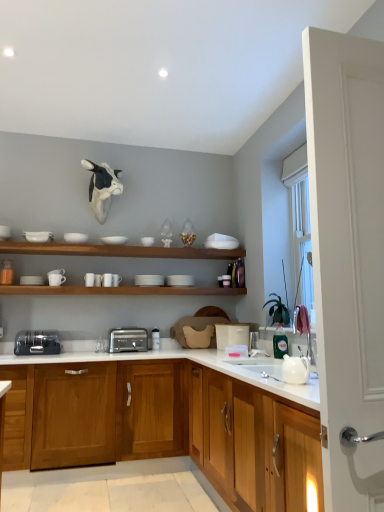
Describe the element at coordinates (149, 280) in the screenshot. The width and height of the screenshot is (384, 512). I see `white matte stack of plates at upper center, the 2th tableware from the right` at that location.

Locate an element on the screen. The height and width of the screenshot is (512, 384). white matte plate at center, which is counted as the 1th tableware, starting from the right is located at coordinates (180, 280).

This screenshot has height=512, width=384. What do you see at coordinates (114, 240) in the screenshot? I see `white matte bowl at upper center, which ranks as the fifth tableware in left-to-right order` at bounding box center [114, 240].

You are a GUI agent. You are given a task and a screenshot of the screen. Output one action in this format:
    pyautogui.click(x=<x>, y=<y>)
    Task: Click on the white matte cup at left, the first tableware when ordered from left to right
    Image resolution: width=384 pixels, height=512 pixels.
    Given the screenshot: What is the action you would take?
    pyautogui.click(x=32, y=280)

In the scene shown: Between white matte cup at center, which is the sixth tableware from right to left, and satin silver toaster at lower left, positioned as the 2th toaster in right-to-left order, which one has smaller size?

white matte cup at center, which is the sixth tableware from right to left, is smaller.

Is white matte cup at center, which is the third tableware in left-to-right order, facing away from satin silver toaster at lower left, positioned as the 2th toaster in right-to-left order?

white matte cup at center, which is the third tableware in left-to-right order, does not have its back to satin silver toaster at lower left, positioned as the 2th toaster in right-to-left order.

In the scene shown: Is there a large distance between white matte cup at center, which is the third tableware in left-to-right order, and satin silver toaster at lower left, positioned as the 2th toaster in right-to-left order?

Actually, white matte cup at center, which is the third tableware in left-to-right order, and satin silver toaster at lower left, positioned as the 2th toaster in right-to-left order, are a little close together.

From a real-world perspective, does white glossy teapot at lower right stand above satin silver toaster at lower left, the first toaster in the left-to-right sequence?

No, from a real-world perspective, white glossy teapot at lower right is not above satin silver toaster at lower left, the first toaster in the left-to-right sequence.

From the image's perspective, relative to satin silver toaster at lower left, positioned as the 2th toaster in right-to-left order, is white glossy teapot at lower right above or below?

Based on their image positions, white glossy teapot at lower right is located above satin silver toaster at lower left, positioned as the 2th toaster in right-to-left order.

Between white glossy teapot at lower right and satin silver toaster at lower left, positioned as the 2th toaster in right-to-left order, which one appears on the right side from the viewer's perspective?

white glossy teapot at lower right is more to the right.

How different are the orientations of white glossy teapot at lower right and satin silver toaster at lower left, the first toaster in the left-to-right sequence, in degrees?

white glossy teapot at lower right and satin silver toaster at lower left, the first toaster in the left-to-right sequence, are facing 93.3 degrees away from each other.

Can white matte cup at left, the 8th tableware viewed from the right, be found inside white matte bowl at upper center, which is the 4th tableware in right-to-left order?

That's incorrect, white matte cup at left, the 8th tableware viewed from the right, is not inside white matte bowl at upper center, which is the 4th tableware in right-to-left order.

Who is more distant, white matte bowl at upper center, which is the 4th tableware in right-to-left order, or white matte cup at left, the first tableware when ordered from left to right?

white matte bowl at upper center, which is the 4th tableware in right-to-left order, is further away from the camera.

Considering the sizes of objects white matte bowl at upper center, which is the 4th tableware in right-to-left order, and white matte cup at left, the first tableware when ordered from left to right, in the image provided, who is thinner, white matte bowl at upper center, which is the 4th tableware in right-to-left order, or white matte cup at left, the first tableware when ordered from left to right,?

white matte cup at left, the first tableware when ordered from left to right, is thinner.

Between point (111, 237) and point (20, 282), which one is positioned in front?

The point (20, 282) is closer to the camera.

Consider the image. From a real-world perspective, is white glossy teapot at lower right physically located above or below white matte cup at left, the 8th tableware viewed from the right?

Clearly, from a real-world perspective, white glossy teapot at lower right is below white matte cup at left, the 8th tableware viewed from the right.

What's the angular difference between white glossy teapot at lower right and white matte cup at left, the 8th tableware viewed from the right,'s facing directions?

white glossy teapot at lower right and white matte cup at left, the 8th tableware viewed from the right, are facing 91.6 degrees away from each other.

Is white glossy teapot at lower right located outside white matte cup at left, the 8th tableware viewed from the right?

Absolutely, white glossy teapot at lower right is external to white matte cup at left, the 8th tableware viewed from the right.

How much distance is there between white glossy teapot at lower right and white matte cup at left, the first tableware when ordered from left to right?

2.40 meters.

Between white matte cups at center, acting as the 1th shelf starting from the bottom, and white matte shelves at upper center, which appears as the second shelf when ordered from the bottom, which one has more height?

white matte cups at center, acting as the 1th shelf starting from the bottom.

Is point (56, 294) positioned before point (214, 249)?

Yes.

Are white matte cups at center, the 2th shelf viewed from the top, and white matte shelves at upper center, which appears as the second shelf when ordered from the bottom, far apart?

No, white matte cups at center, the 2th shelf viewed from the top, is not far from white matte shelves at upper center, which appears as the second shelf when ordered from the bottom.

Is white matte cups at center, the 2th shelf viewed from the top, to the right of white matte shelves at upper center, which appears as the second shelf when ordered from the bottom, from the viewer's perspective?

Indeed, white matte cups at center, the 2th shelf viewed from the top, is positioned on the right side of white matte shelves at upper center, which appears as the second shelf when ordered from the bottom.

Can you confirm if white matte cups at center, the 2th shelf viewed from the top, is wider than white glossy bowl at upper left, placed as the second tableware when sorted from left to right?

Correct, the width of white matte cups at center, the 2th shelf viewed from the top, exceeds that of white glossy bowl at upper left, placed as the second tableware when sorted from left to right.

In the scene shown: Between white matte cups at center, acting as the 1th shelf starting from the bottom, and white glossy bowl at upper left, placed as the second tableware when sorted from left to right, which one appears on the left side from the viewer's perspective?

white glossy bowl at upper left, placed as the second tableware when sorted from left to right, is more to the left.

From the image's perspective, which object appears higher, white matte cups at center, the 2th shelf viewed from the top, or white glossy bowl at upper left, placed as the second tableware when sorted from left to right?

white glossy bowl at upper left, placed as the second tableware when sorted from left to right, is shown above in the image.

In terms of size, does satin silver toaster at center, which ranks as the 2th toaster in left-to-right order, appear bigger or smaller than white matte plate at center, the 8th tableware from the left?

Considering their sizes, satin silver toaster at center, which ranks as the 2th toaster in left-to-right order, takes up more space than white matte plate at center, the 8th tableware from the left.

From a real-world perspective, between satin silver toaster at center, which is the 1th toaster from right to left, and white matte plate at center, the 8th tableware from the left, who is vertically lower?

satin silver toaster at center, which is the 1th toaster from right to left, is physically lower.

Between satin silver toaster at center, which ranks as the 2th toaster in left-to-right order, and white matte plate at center, which is counted as the 1th tableware, starting from the right, which one appears on the left side from the viewer's perspective?

satin silver toaster at center, which ranks as the 2th toaster in left-to-right order, is more to the left.

You are a GUI agent. You are given a task and a screenshot of the screen. Output one action in this format:
    pyautogui.click(x=<x>, y=<y>)
    Task: Click on the 1st toaster in front of the white matte plate at center, which is counted as the 1th tableware, starting from the right
    
    Given the screenshot: What is the action you would take?
    pyautogui.click(x=128, y=340)

From the image's perspective, count 1st toasters downward from the white matte cup at center, which is the third tableware in left-to-right order, and point to it. Please provide its 2D coordinates.

[(37, 342)]

Where is `the 1st toaster behind the white glossy teapot at lower right`? the 1st toaster behind the white glossy teapot at lower right is located at coordinates (37, 342).

Estimate the real-world distances between objects in this image. Which object is further from white glossy bowl at upper left, placed as the second tableware when sorted from left to right, white glossy teapot at lower right or white matte stack of plates at upper center, the 2th tableware from the right?

white glossy teapot at lower right.

Estimate the real-world distances between objects in this image. Which object is closer to white matte bowl at upper center, which ranks as the 5th tableware in right-to-left order, white matte plate at center, the 8th tableware from the left, or satin silver toaster at center, which ranks as the 2th toaster in left-to-right order?

Among the two, white matte plate at center, the 8th tableware from the left, is located nearer to white matte bowl at upper center, which ranks as the 5th tableware in right-to-left order.

When comparing their distances from satin silver toaster at center, which ranks as the 2th toaster in left-to-right order, does wooden cabinet at center, which is counted as the first cabinetry, starting from the back, or white plastic container at center seem closer?

Among the two, wooden cabinet at center, which is counted as the first cabinetry, starting from the back, is located nearer to satin silver toaster at center, which ranks as the 2th toaster in left-to-right order.

Which object lies nearer to the anchor point wooden cabinet at center, which is counted as the first cabinetry, starting from the back, white matte cup at upper center, which appears as the third tableware when viewed from the right, or white plastic container at center?

white plastic container at center.

From the image, which object appears to be nearer to white matte cup at center, which is the third tableware in left-to-right order, wooden cabinet at center, which is counted as the first cabinetry, starting from the back, or white matte cup at left, the first tableware when ordered from left to right?

white matte cup at left, the first tableware when ordered from left to right, is positioned closer to the anchor white matte cup at center, which is the third tableware in left-to-right order.

Which object lies further to the anchor point white matte cup at upper center, which appears as the 6th tableware when viewed from the left, white matte shelves at upper center, which appears as the second shelf when ordered from the bottom, or white matte bowl at upper center, which ranks as the fifth tableware in left-to-right order?

The object further to white matte cup at upper center, which appears as the 6th tableware when viewed from the left, is white matte shelves at upper center, which appears as the second shelf when ordered from the bottom.

Looking at the image, which one is located closer to white matte cups at center, acting as the 1th shelf starting from the bottom, satin silver toaster at center, which is the 1th toaster from right to left, or white plastic container at center?

satin silver toaster at center, which is the 1th toaster from right to left, is closer to white matte cups at center, acting as the 1th shelf starting from the bottom.

Which object lies nearer to the anchor point satin silver toaster at center, which ranks as the 2th toaster in left-to-right order, white matte plate at center, which is counted as the 1th tableware, starting from the right, or white glossy teapot at lower right?

white matte plate at center, which is counted as the 1th tableware, starting from the right.

Identify the location of cabinetry positioned between white glossy teapot at lower right and white matte bowl at upper center, the 4th tableware positioned from the left, from near to far. coord(165,426).

Where is `cabinetry located between white glossy bowl at upper left, which is counted as the seventh tableware, starting from the right, and white glossy teapot at lower right in the left-right direction`? cabinetry located between white glossy bowl at upper left, which is counted as the seventh tableware, starting from the right, and white glossy teapot at lower right in the left-right direction is located at coordinates (165, 426).

Locate an element on the screen. tableware between white matte bowl at upper center, which ranks as the 5th tableware in right-to-left order, and white matte shelves at upper center, which appears as the second shelf when ordered from the bottom, from left to right is located at coordinates (114, 240).

Locate an element on the screen. appliance located between white glossy teapot at lower right and white matte cup at upper center, which appears as the 6th tableware when viewed from the left, in the depth direction is located at coordinates (231, 335).